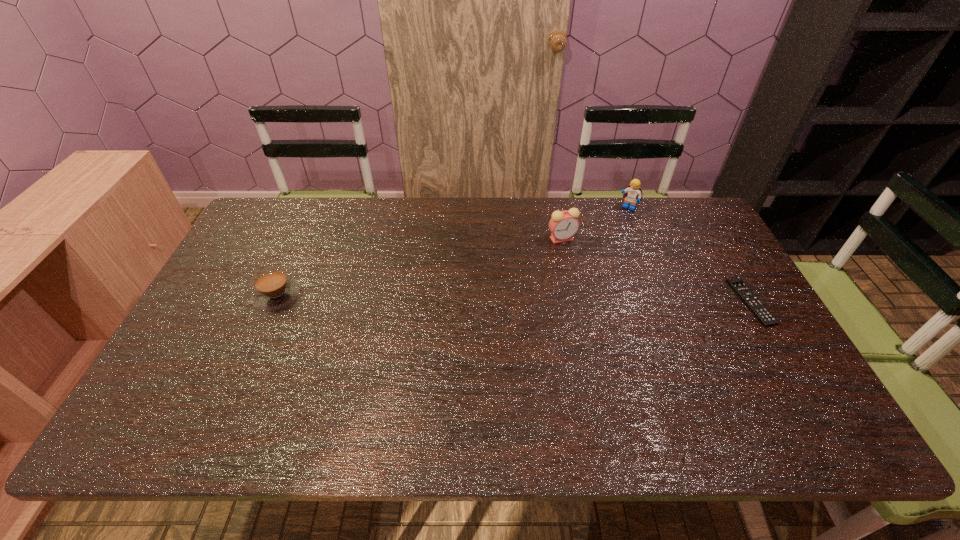
Where is `vacant area situated 0.120m on the face of the third object from right to left`? vacant area situated 0.120m on the face of the third object from right to left is located at coordinates (544, 267).

Where is `vacant space located on the face of the third object from right to left`? This screenshot has height=540, width=960. vacant space located on the face of the third object from right to left is located at coordinates (544, 267).

Find the location of a particular element. The image size is (960, 540). vacant space located on the face of the third object from right to left is located at coordinates (543, 269).

This screenshot has height=540, width=960. I want to click on free space located on the front-facing side of the third object from left to right, so click(614, 226).

Locate an element on the screen. vacant space located on the front-facing side of the third object from left to right is located at coordinates (606, 241).

Where is `vacant space located on the front-facing side of the third object from left to right`? Image resolution: width=960 pixels, height=540 pixels. vacant space located on the front-facing side of the third object from left to right is located at coordinates (618, 219).

This screenshot has width=960, height=540. I want to click on alarm clock at the far edge, so click(x=563, y=225).

You are a GUI agent. You are given a task and a screenshot of the screen. Output one action in this format:
    pyautogui.click(x=<x>, y=<y>)
    Task: Click on the Lego that is positioned at the far edge
    
    Given the screenshot: What is the action you would take?
    coord(633,193)

In order to click on object that is positioned at the left edge in this screenshot , I will do `click(273, 289)`.

Identify the location of object that is at the right edge. pos(766,318).